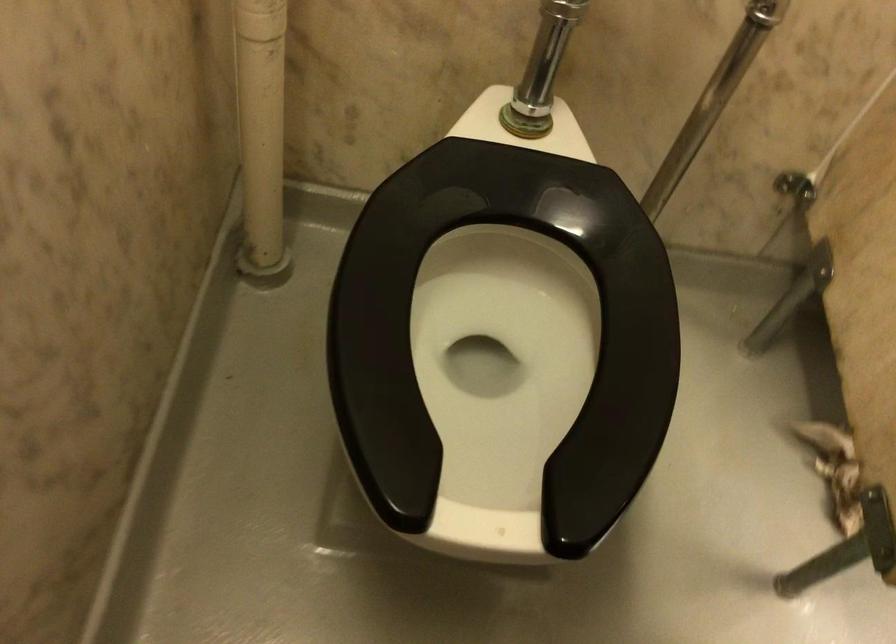
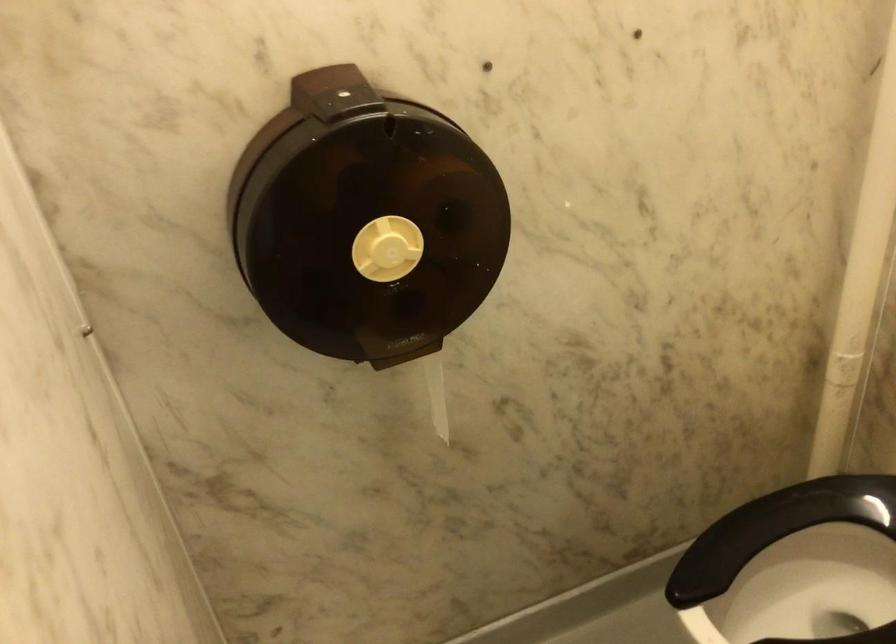
The point at (408, 305) is marked in the first image. Where is the corresponding point in the second image?

(780, 536)